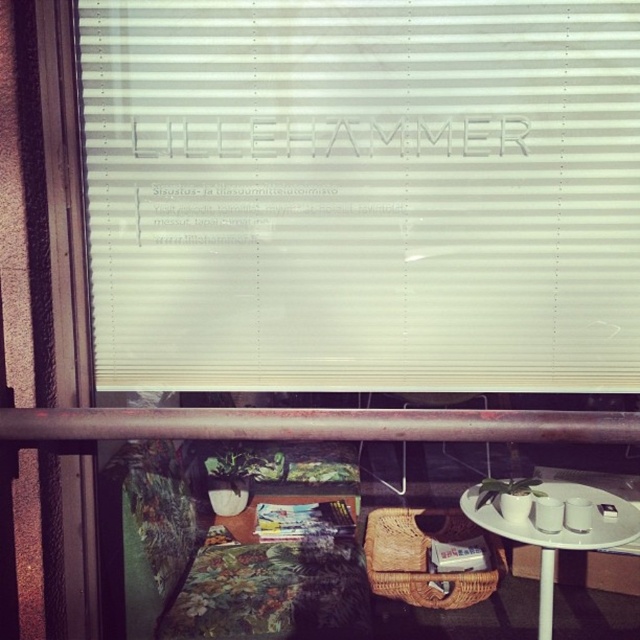
Question: Which point is closer to the camera taking this photo?

Choices:
 (A) (540, 577)
 (B) (348, 179)
 (C) (387, 412)

Answer: (C)

Question: Does rusty metal rail at lower center have a smaller size compared to white ceramic table at lower right?

Choices:
 (A) yes
 (B) no

Answer: (A)

Question: Is white matte blinds at center bigger than white ceramic table at lower right?

Choices:
 (A) no
 (B) yes

Answer: (B)

Question: Which point is closer to the camera?

Choices:
 (A) white ceramic table at lower right
 (B) white matte blinds at center
 (C) rusty metal rail at lower center

Answer: (C)

Question: Which object is farther from the camera taking this photo?

Choices:
 (A) white matte blinds at center
 (B) rusty metal rail at lower center
 (C) white ceramic table at lower right

Answer: (C)

Question: Does rusty metal rail at lower center appear on the right side of white ceramic table at lower right?

Choices:
 (A) no
 (B) yes

Answer: (A)